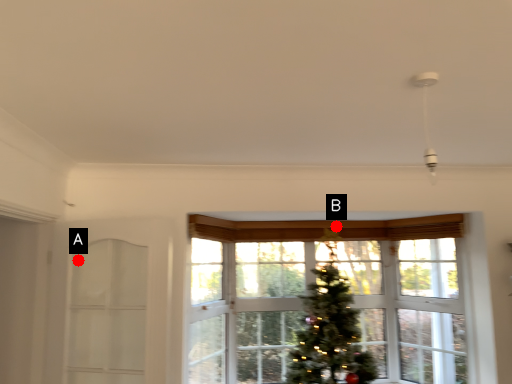
Question: Two points are circled on the image, labeled by A and B beside each circle. Among these points, which one is farthest from the camera?

Choices:
 (A) A is further
 (B) B is further

Answer: (B)